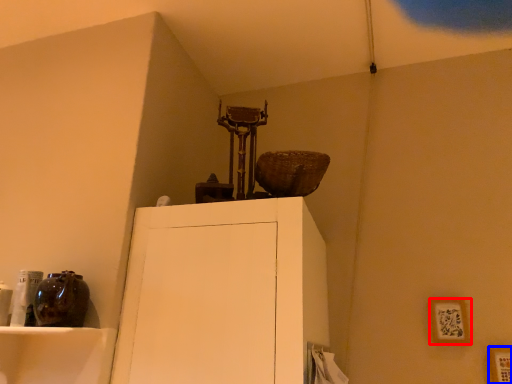
Question: Among these objects, which one is nearest to the camera, picture frame (highlighted by a red box) or picture frame (highlighted by a blue box)?

Choices:
 (A) picture frame
 (B) picture frame

Answer: (B)